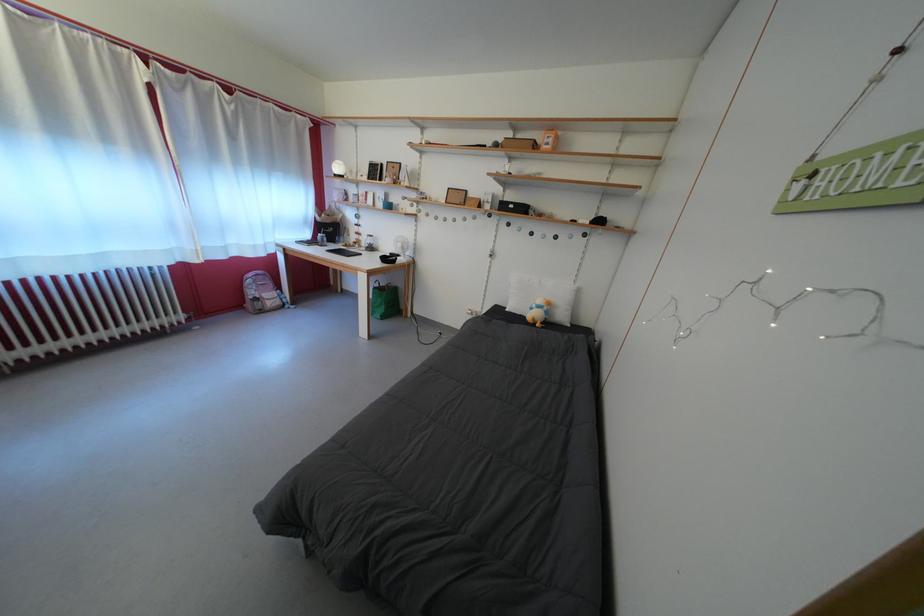
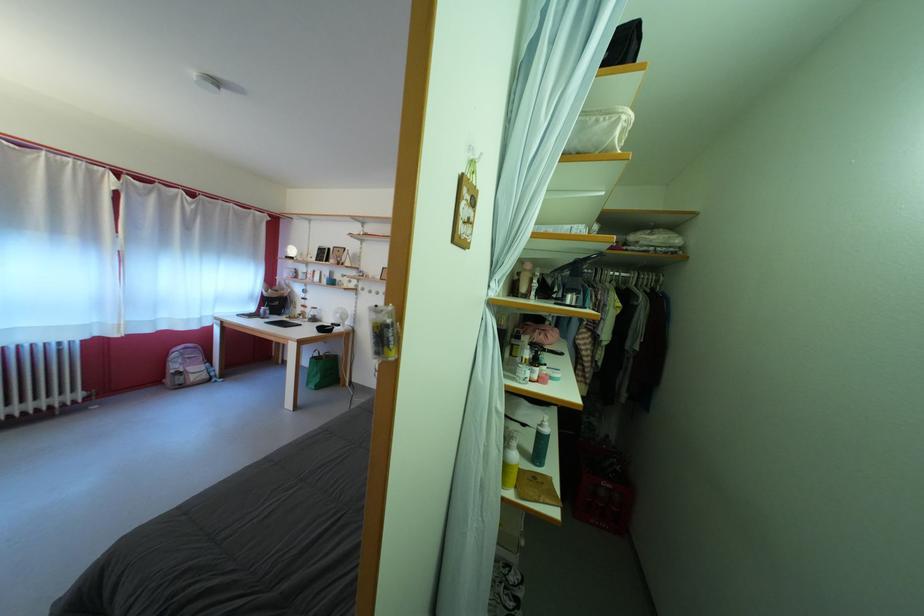
Where in the second image is the point corresponding to point 261,299 from the first image?

(184, 373)